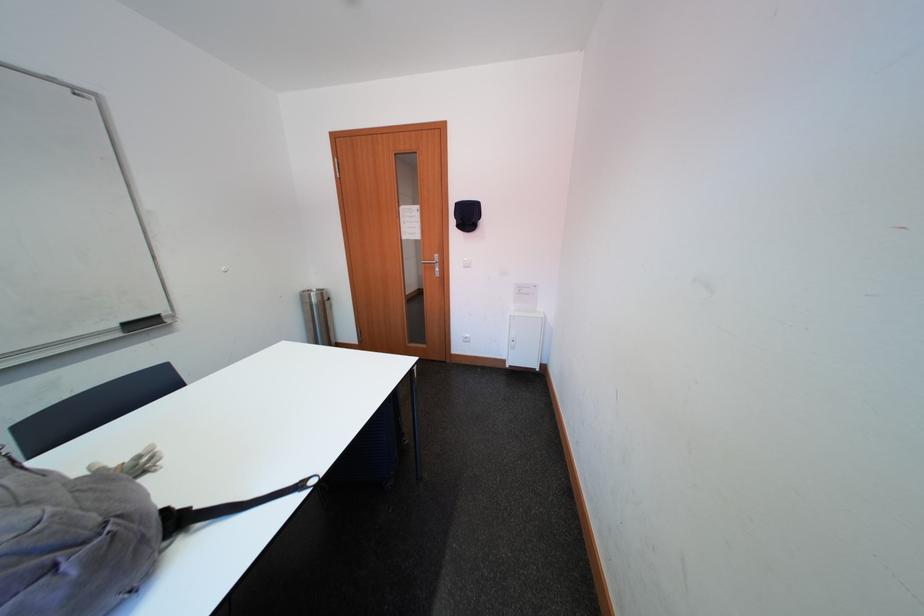
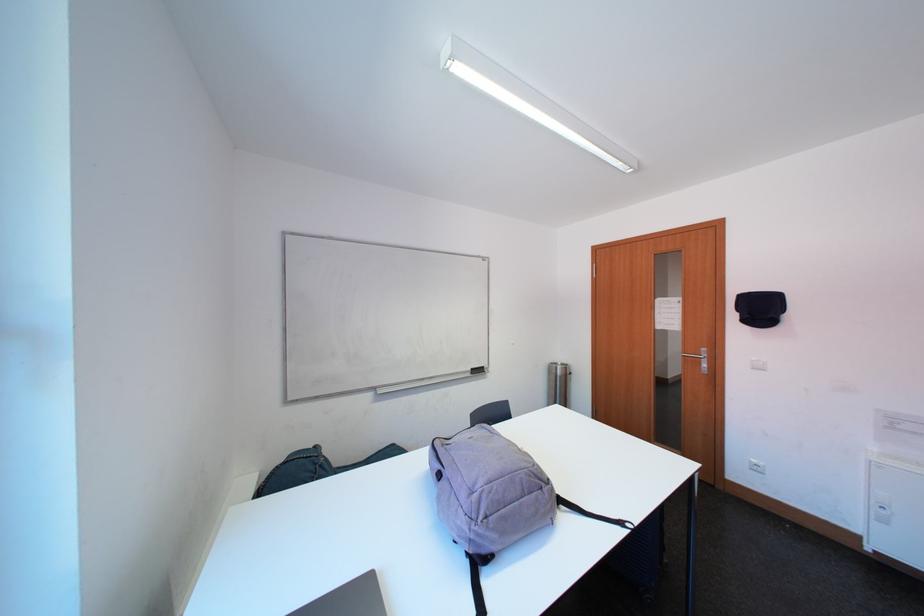
In the second image, find the point that corresponds to point 64,572 in the first image.

(551, 492)